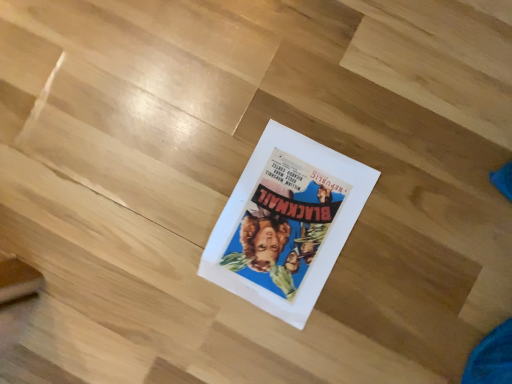
The image size is (512, 384). I want to click on vacant space in front of white paper poster at center, so click(379, 307).